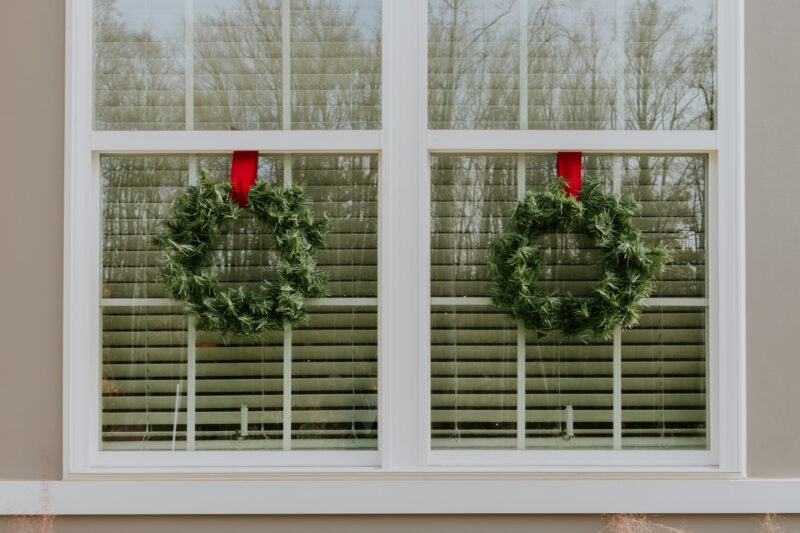
I want to click on left wreath, so click(286, 303).